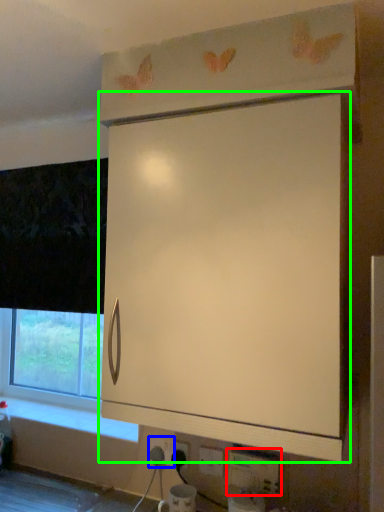
Question: Which object is positioned farthest from electric outlet (highlighted by a red box)? Select from electric outlet (highlighted by a blue box) and cabinetry (highlighted by a green box).

Choices:
 (A) electric outlet
 (B) cabinetry

Answer: (B)